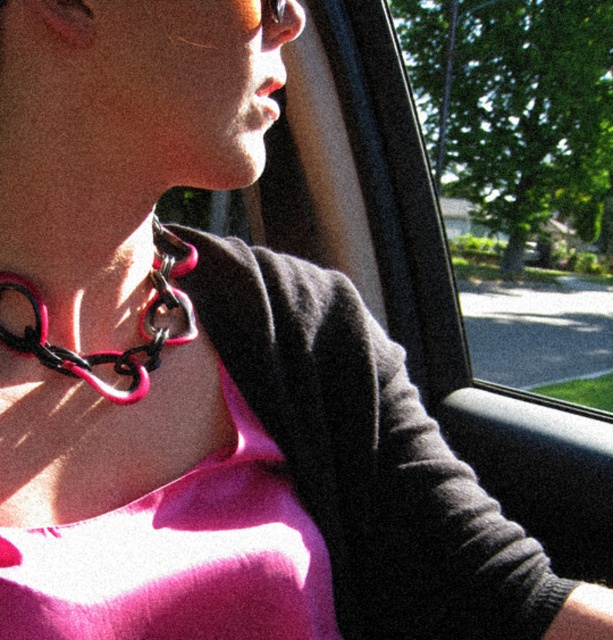
Can you confirm if transparent glass at center is thinner than pink plastic chain at center?

No.

Find the location of `transparent glass at center`. transparent glass at center is located at coordinates (516, 108).

Find the location of a particular element. The image size is (613, 640). transparent glass at center is located at coordinates (516, 108).